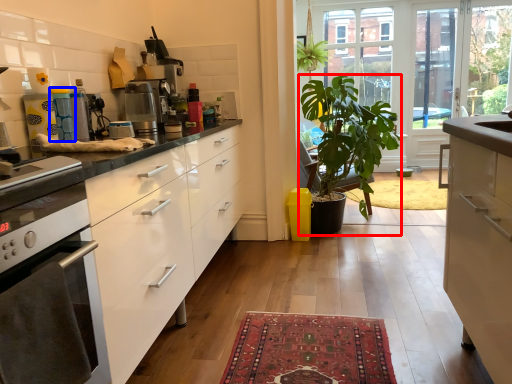
Question: Among these objects, which one is farthest to the camera, houseplant (highlighted by a red box) or appliance (highlighted by a blue box)?

Choices:
 (A) houseplant
 (B) appliance

Answer: (A)